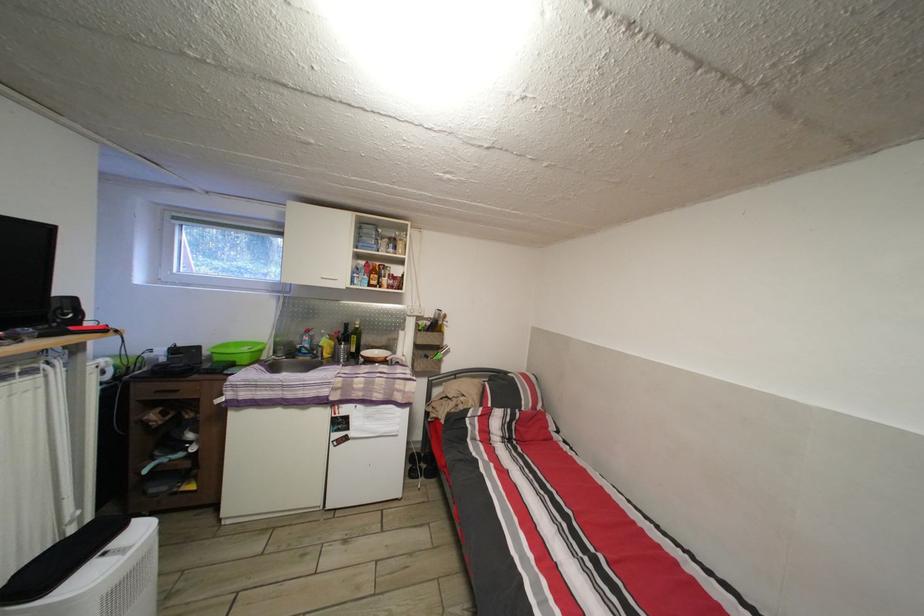
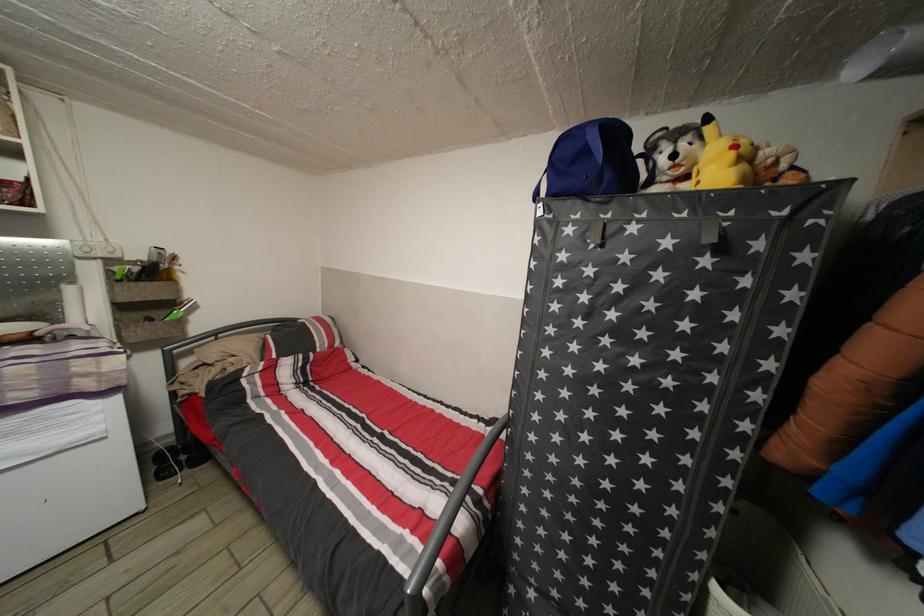
The point at [426,461] is marked in the first image. Where is the corresponding point in the second image?

(177, 455)